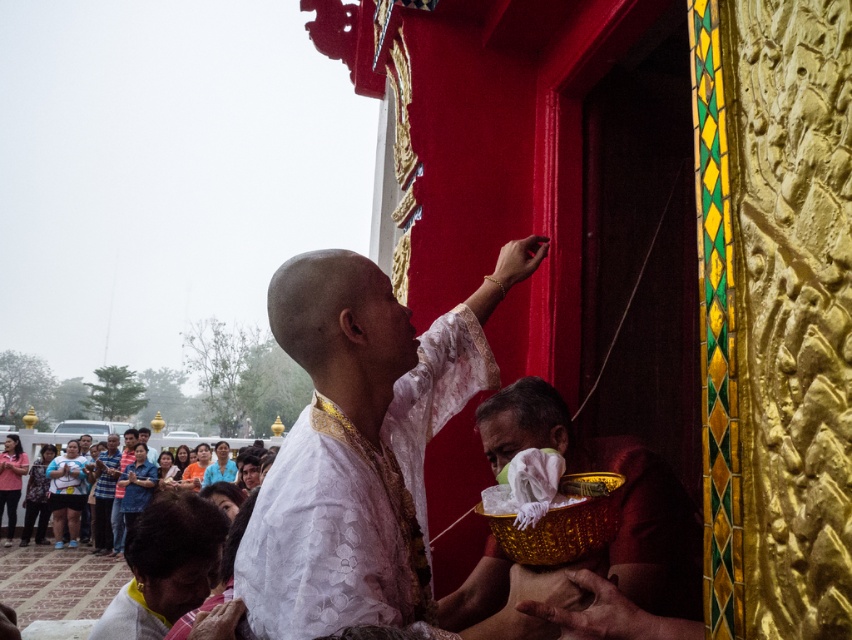
You are a photographer at the event and want to capture the white lace cloth at center in your shot. The temple walls are red with golden carvings. Where should you position your camera relative to the man to ensure the cloth is centered in the frame?

The white lace cloth at center is located at point (360, 440), so position the camera directly facing the center area where the cloth is placed to center it in the frame.

You are attending a ceremony at the temple and notice two items at the center of the scene. The items are the white lace cloth at center and the matte white shirt at center. Which item is shorter in height?

The white lace cloth at center is not as tall as the matte white shirt at center, so the white lace cloth at center is shorter in height.

You are a photographer at the event and need to capture a closeup shot of both the white lace cloth at center and the white matte shirt at center. The camera lens has a maximum focus range of 5 feet. Can you capture both objects in focus without moving the camera?

The white lace cloth at center is 4.82 feet from the white matte shirt at center. Since the distance between them is within the camera lens maximum focus range of 5 feet, you can capture both objects in focus without moving the camera.